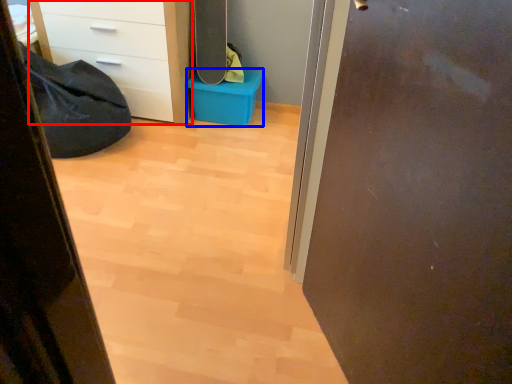
Question: Which point is closer to the camera, chest of drawers (highlighted by a red box) or storage box (highlighted by a blue box)?

Choices:
 (A) chest of drawers
 (B) storage box

Answer: (A)